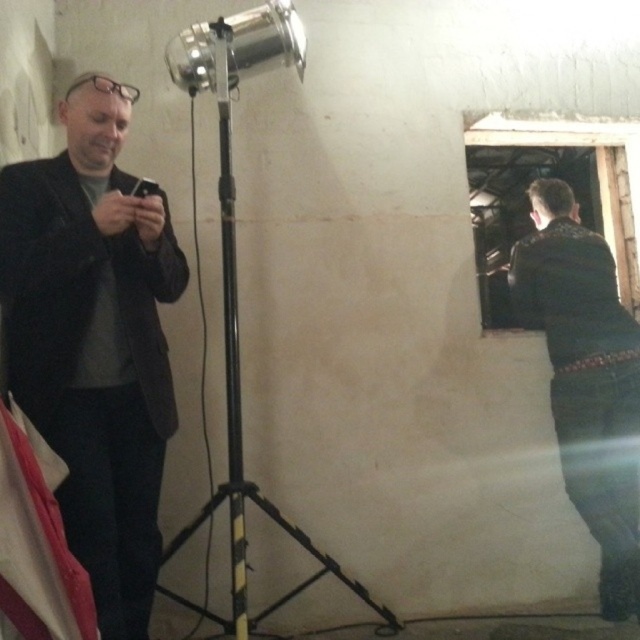
Question: Is black matte suit at left smaller than black matte tripod at center?

Choices:
 (A) yes
 (B) no

Answer: (A)

Question: Considering the real-world distances, which object is closest to the black matte suit at left?

Choices:
 (A) dark green leather jacket at right
 (B) black matte tripod at center

Answer: (B)

Question: Is black matte suit at left further to the viewer compared to black matte tripod at center?

Choices:
 (A) no
 (B) yes

Answer: (A)

Question: Can you confirm if dark green leather jacket at right is positioned below black matte tripod at center?

Choices:
 (A) no
 (B) yes

Answer: (B)

Question: Which object appears closest to the camera in this image?

Choices:
 (A) black matte suit at left
 (B) dark green leather jacket at right
 (C) black matte tripod at center

Answer: (A)

Question: Which point appears farthest from the camera in this image?

Choices:
 (A) (180, 600)
 (B) (525, 260)
 (C) (40, 426)

Answer: (B)